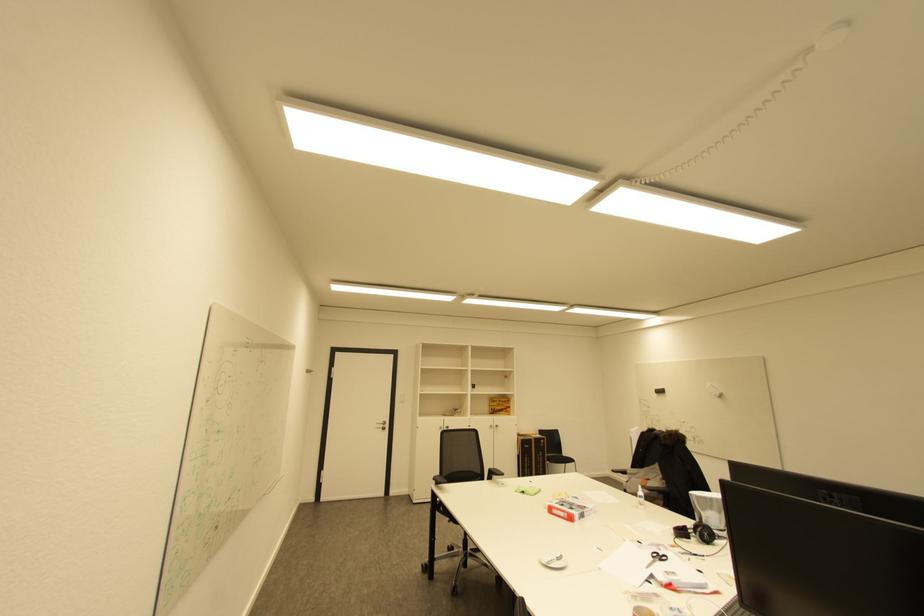
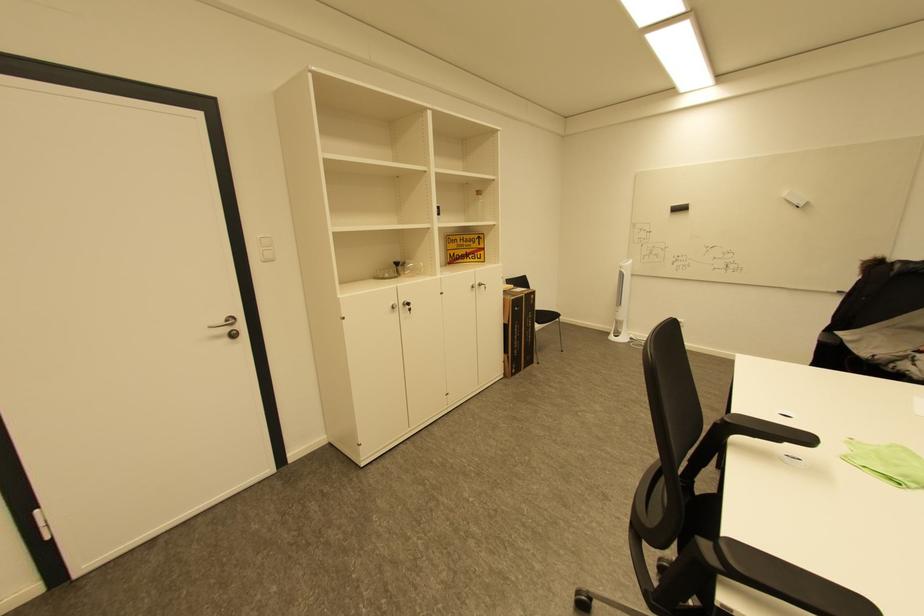
Where in the second image is the point corresponding to (388,427) from the first image?

(233, 330)